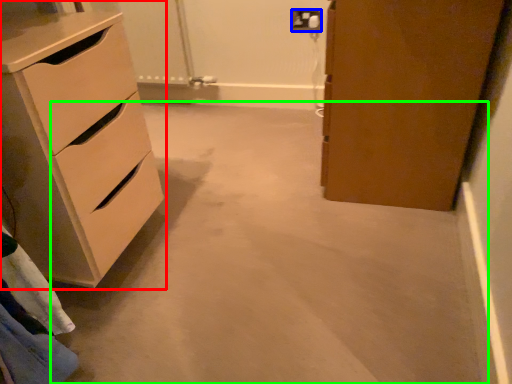
Question: Estimate the real-world distances between objects in this image. Which object is farther from chest of drawers (highlighted by a red box), electric outlet (highlighted by a blue box) or concrete (highlighted by a green box)?

Choices:
 (A) electric outlet
 (B) concrete

Answer: (A)